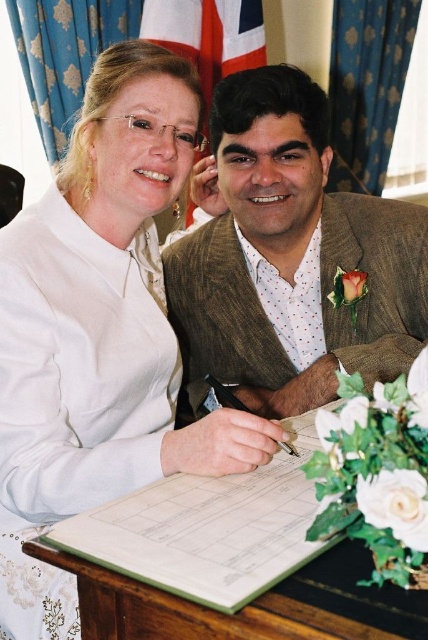
You are a photographer at the event and need to capture a closeup of the white matte shirt at upper left without the wooden table at center showing in the background. Is this possible given their positions?

The white matte shirt at upper left is positioned over the wooden table at center, so it is likely blocking the table from view. A closeup of the shirt would not show the table in the background.

You are an event planner assessing the seating arrangement for a formal event. You notice the white matte shirt at upper left and the brown textured suit at center. Which of these two items has a narrower width?

The white matte shirt at upper left has a lesser width compared to the brown textured suit at center, so the white matte shirt at upper left is narrower in width.

What object is located at the coordinates point [293,259] in the image?

The point [293,259] indicates the location of the brown textured suit at center.